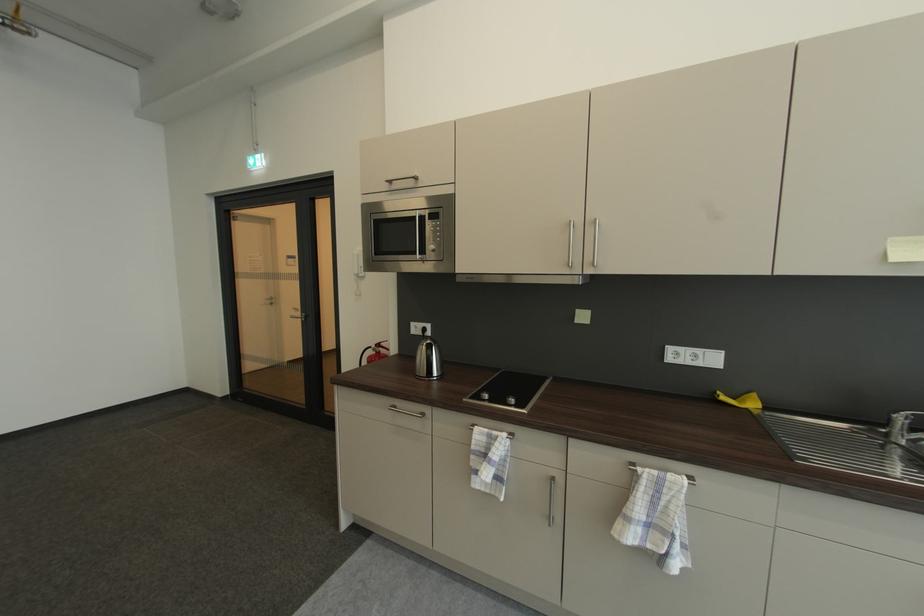
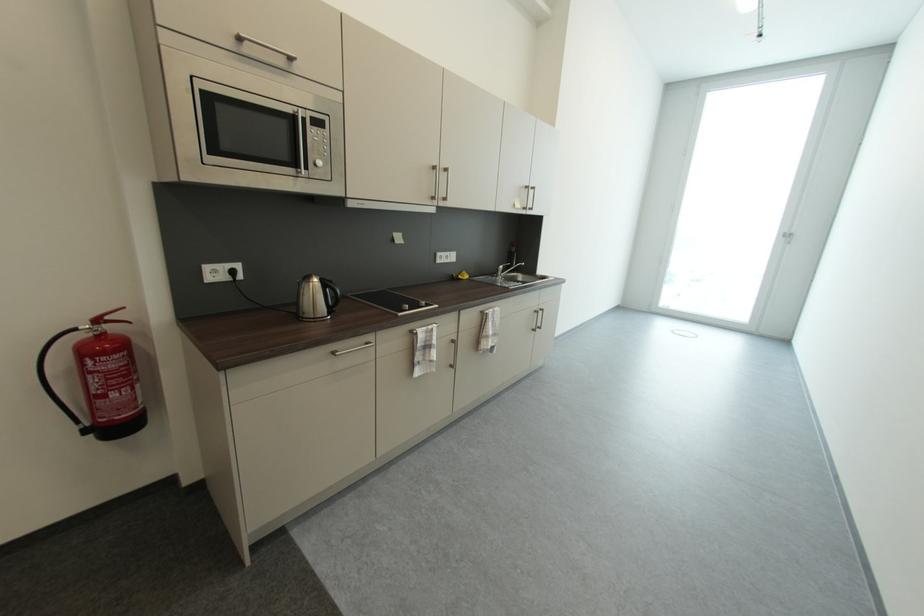
Locate, in the second image, the point that corresponds to [388,346] in the first image.

(116, 318)